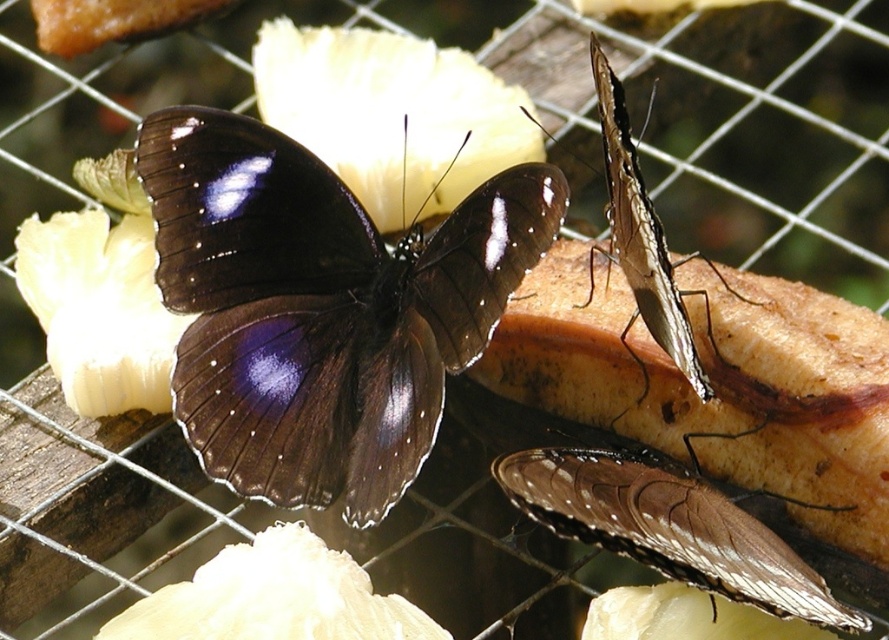
You are an entomologist observing the butterflies. You need to determine which butterfly has a wider wingspan between the matte black butterfly at center and the shiny brown butterfly at upper right based on their positions. Can you determine this?

The matte black butterfly at center might be wider than shiny brown butterfly at upper right according to the description.

You are an entomologist studying the positioning of butterflies on fruit slices. You observe the matte black butterfly at center. What are the precise coordinates of its position?

The precise coordinates of the matte black butterfly at center are at point (321, 307).